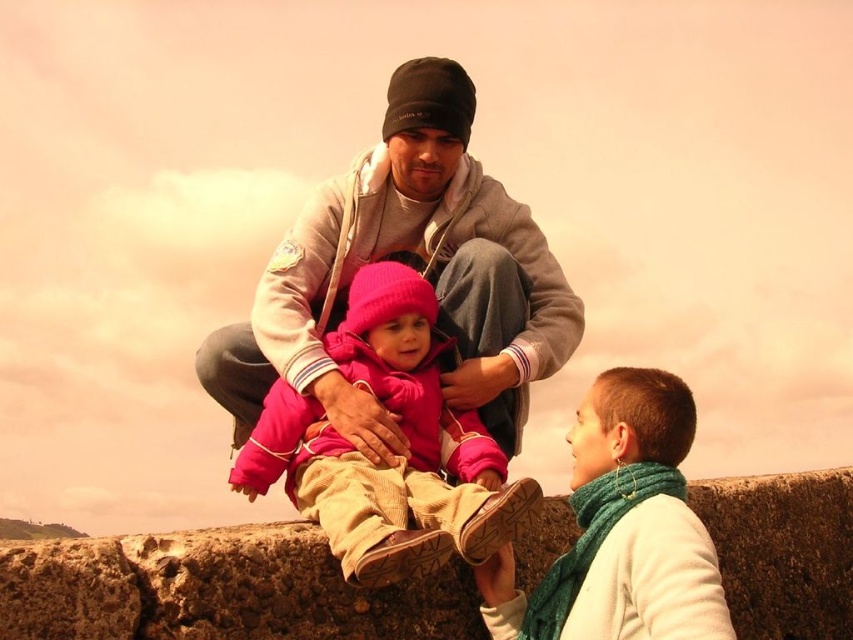
Between pink fleece jacket at center and green knitted scarf at lower right, which one has less height?

green knitted scarf at lower right

Identify the location of pink fleece jacket at center. (405, 436).

Between point (360, 502) and point (708, 570), which one is positioned behind?

Point (360, 502)

Locate an element on the screen. This screenshot has height=640, width=853. pink fleece jacket at center is located at coordinates (405, 436).

Who is higher up, gray fleece jacket at center or pink fleece jacket at center?

gray fleece jacket at center

Does gray fleece jacket at center have a greater width compared to pink fleece jacket at center?

Yes, gray fleece jacket at center is wider than pink fleece jacket at center.

What do you see at coordinates (413, 268) in the screenshot? I see `gray fleece jacket at center` at bounding box center [413, 268].

The width and height of the screenshot is (853, 640). Identify the location of gray fleece jacket at center. (413, 268).

From the picture: Which is below, gray fleece jacket at center or green knitted scarf at lower right?

green knitted scarf at lower right

Who is more forward, (438, 282) or (606, 625)?

Positioned in front is point (606, 625).

Find the location of `gray fleece jacket at center`. gray fleece jacket at center is located at coordinates (413, 268).